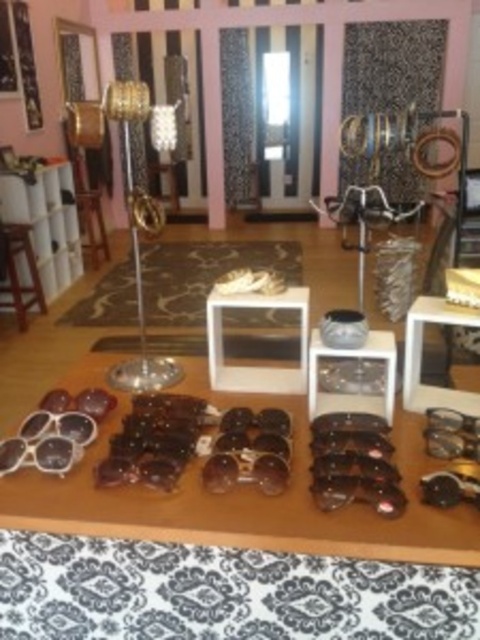
You are a customer looking to pick up the matte black sunglasses at lower left and the black plastic sunglasses at center. Which one should you move towards first if you are standing to the right of both items?

You should move towards the matte black sunglasses at lower left first since it is to the left of the black plastic sunglasses at center, making it closer to your current position on the right side.